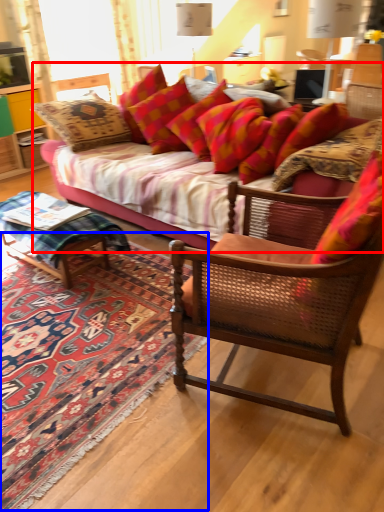
Question: Which object appears farthest to the camera in this image, studio couch (highlighted by a red box) or mat (highlighted by a blue box)?

Choices:
 (A) studio couch
 (B) mat

Answer: (A)